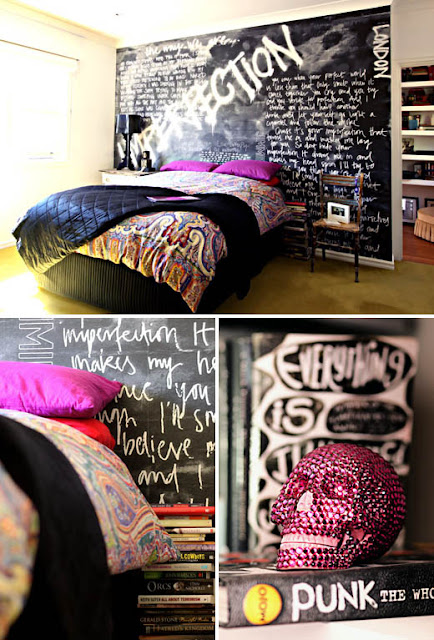
This screenshot has height=640, width=434. I want to click on chair, so click(x=352, y=227).